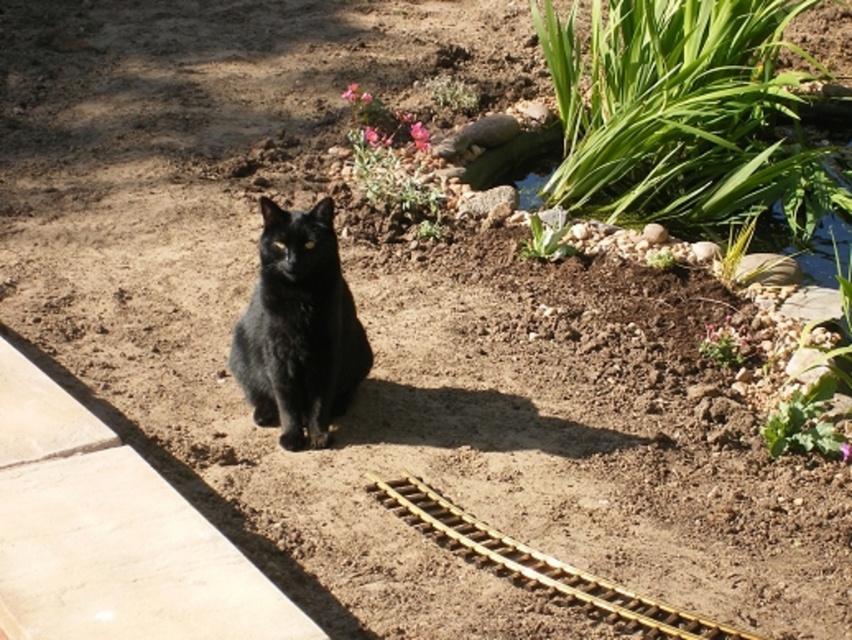
Which is below, black fur cat at center or gold metallic train track at center?

gold metallic train track at center

Which of these two, black fur cat at center or gold metallic train track at center, stands shorter?

gold metallic train track at center is shorter.

Who is more forward, (306,372) or (484,536)?

Point (484,536) is in front.

What are the coordinates of `black fur cat at center` in the screenshot? It's located at (298, 330).